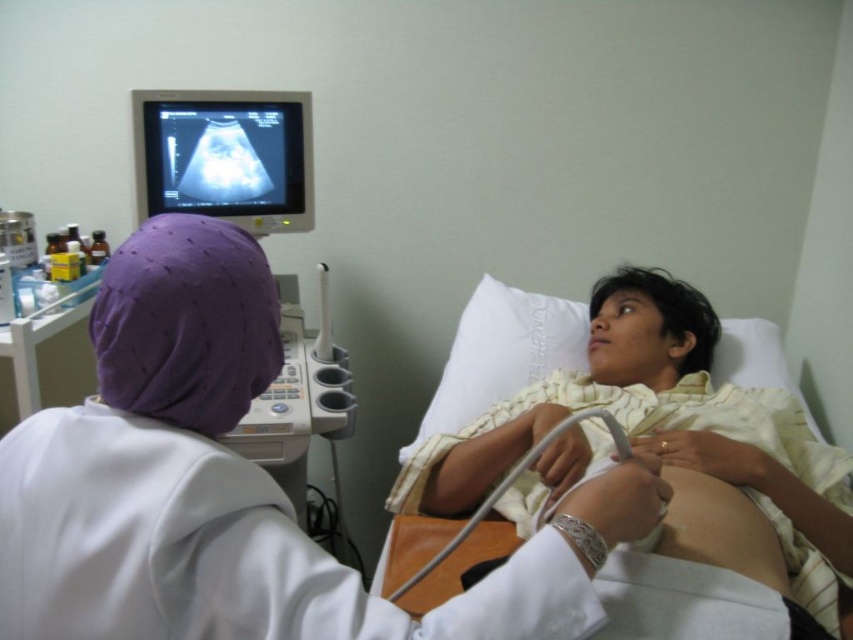
You are a medical student who needs to locate the hospital bed for a patient. According to the coordinates provided, where exactly is the white fabric hospital bed at center located in the image?

The white fabric hospital bed at center is located at coordinates point (665, 433).

You are a patient in the room and want to see the ultrasound images displayed on the matte black monitor at upper left while the medical professional is using the gray rubber ultrasound probe at lower center. Can you see the monitor without moving your head?

The matte black monitor at upper left is to the left of the gray rubber ultrasound probe at lower center. Since the monitor is positioned to the left of the probe, which is being used by the medical professional at lower center, you should be able to see the matte black monitor at upper left without moving your head as it is in your line of sight.